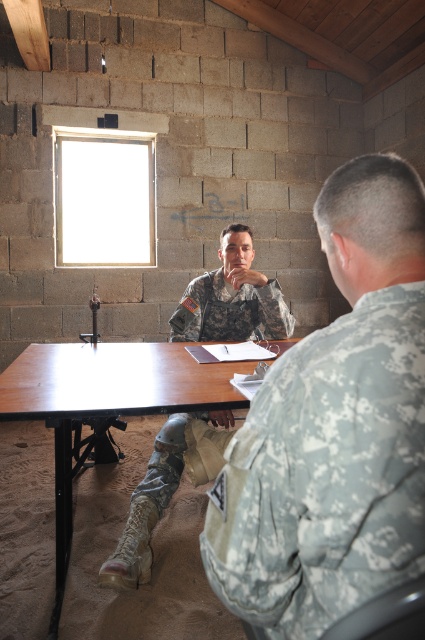
This screenshot has width=425, height=640. What do you see at coordinates (325, 474) in the screenshot?
I see `camouflage fabric uniform at back` at bounding box center [325, 474].

Can you confirm if camouflage fabric uniform at back is shorter than camouflage uniform at center?

Yes.

Where is `camouflage fabric uniform at back`? Image resolution: width=425 pixels, height=640 pixels. camouflage fabric uniform at back is located at coordinates [325, 474].

Is camouflage uniform at center taller than brown wood table at center?

Correct, camouflage uniform at center is much taller as brown wood table at center.

Who is taller, camouflage uniform at center or brown wood table at center?

camouflage uniform at center is taller.

Is point (167, 472) more distant than point (79, 396)?

Yes.

At what (x,y) coordinates should I click in order to perform the action: click on camouflage uniform at center. Please return your answer as a coordinate pair (x, y). This screenshot has height=640, width=425. Looking at the image, I should click on (232, 298).

Looking at this image, which is more to the left, camouflage fabric uniform at back or brown wood table at center?

brown wood table at center

Is point (226, 509) positioned in front of point (14, 358)?

That is True.

Where is `camouflage fabric uniform at back`? The height and width of the screenshot is (640, 425). camouflage fabric uniform at back is located at coordinates (325, 474).